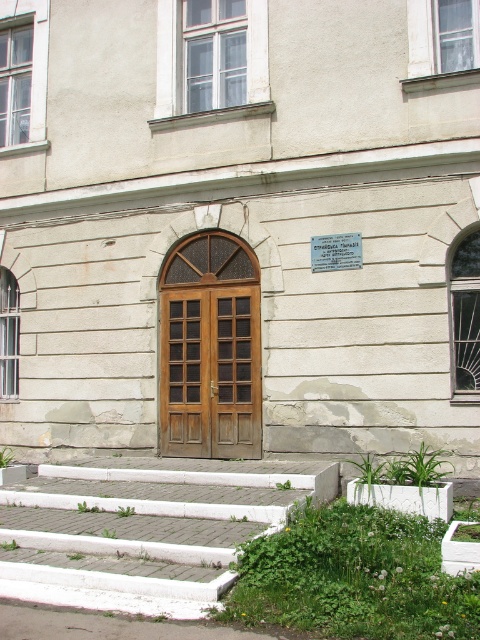
Question: Can you confirm if white concrete stairs at lower center is positioned to the right of wooden door at center?

Choices:
 (A) no
 (B) yes

Answer: (A)

Question: Which of the following is the closest to the observer?

Choices:
 (A) (48, 573)
 (B) (171, 396)

Answer: (A)

Question: Observing the image, what is the correct spatial positioning of white concrete stairs at lower center in reference to wooden door at center?

Choices:
 (A) right
 (B) left

Answer: (B)

Question: Which point is farther to the camera?

Choices:
 (A) (233, 419)
 (B) (148, 554)

Answer: (A)

Question: Does white concrete stairs at lower center appear under wooden door at center?

Choices:
 (A) no
 (B) yes

Answer: (B)